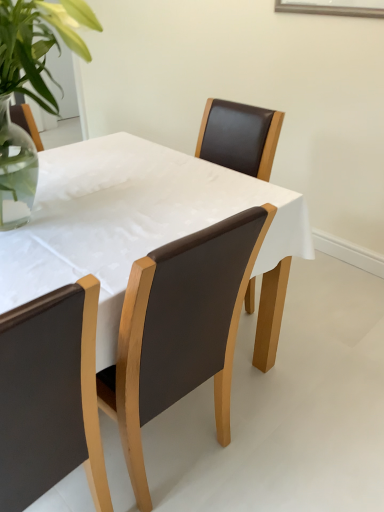
Identify the location of spots to the right of matte brown table at center. (322, 367).